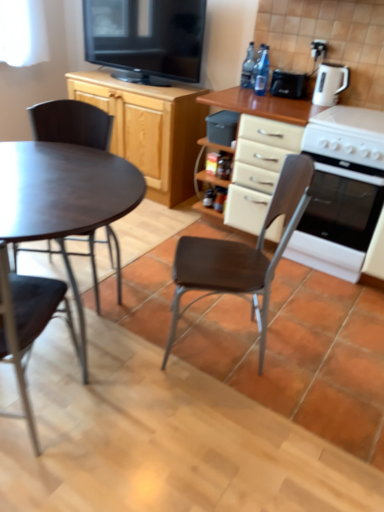
Locate an element on the screen. This screenshot has width=384, height=512. free space between white glossy oven at right and brown leather chair at center, which appears as the 1th chair when viewed from the right is located at coordinates (295, 304).